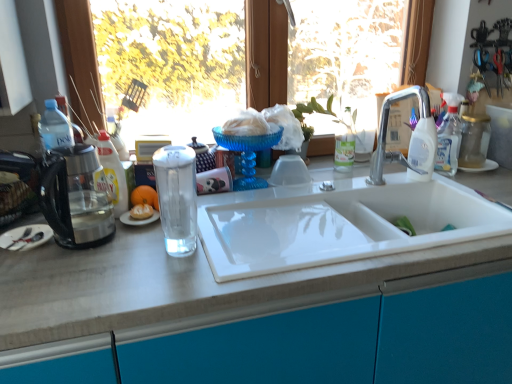
At what (x,y) coordinates should I click in order to perform the action: click on vacant space behind clear glass water at center. Please return your answer as a coordinate pair (x, y). This screenshot has height=384, width=512. Looking at the image, I should click on (218, 216).